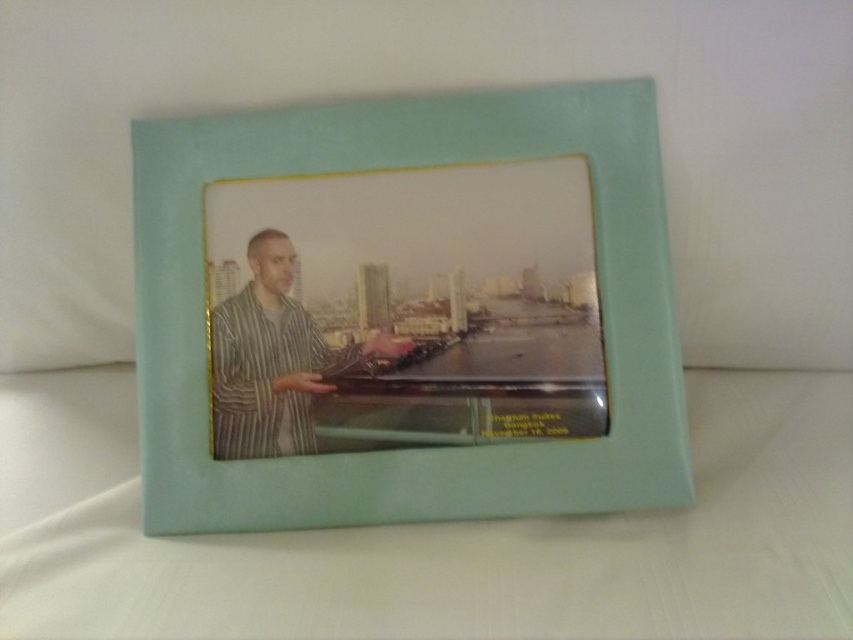
Question: From the image, what is the correct spatial relationship of mint green leather picture frame at center in relation to striped fabric man at center?

Choices:
 (A) right
 (B) left

Answer: (A)

Question: Which point is closer to the camera taking this photo?

Choices:
 (A) (663, 422)
 (B) (305, 394)

Answer: (A)

Question: Is mint green leather picture frame at center positioned before striped fabric man at center?

Choices:
 (A) no
 (B) yes

Answer: (B)

Question: Among these objects, which one is farthest from the camera?

Choices:
 (A) striped fabric man at center
 (B) mint green leather picture frame at center

Answer: (A)

Question: Is mint green leather picture frame at center above striped fabric man at center?

Choices:
 (A) no
 (B) yes

Answer: (B)